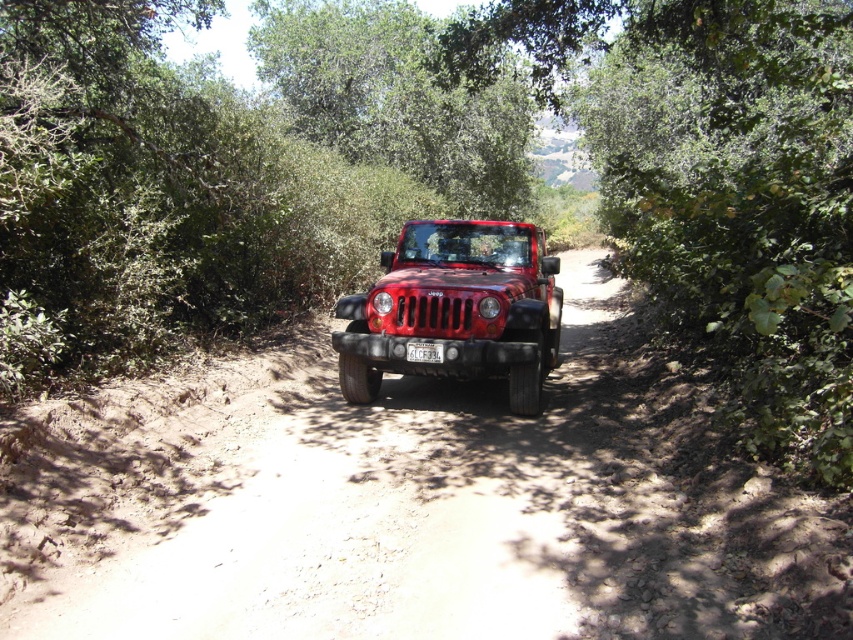
Between green leafy tree at center and matte red jeep at center, which one is positioned lower?

matte red jeep at center is below.

Describe the element at coordinates (717, 184) in the screenshot. I see `green leafy tree at center` at that location.

Identify the location of green leafy tree at center. (717, 184).